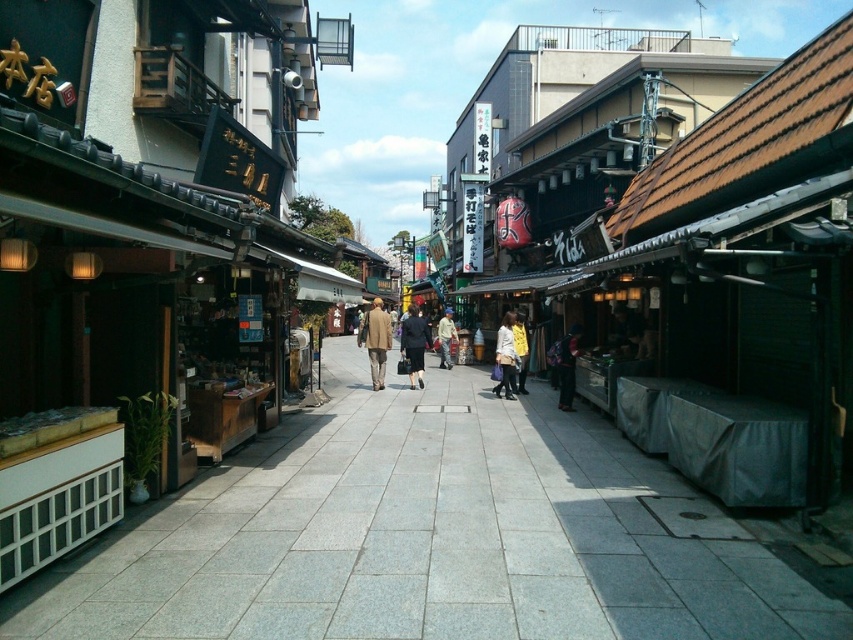
You are a street performer in the Japanese historic district. You have a matte black coat at center and a yellow fabric bag at center. Which one is more to the left?

The matte black coat at center is more to the left.

You are a delivery person carrying a package that requires a 30 feet clearance to maneuver safely. You see the gray stone pavement at center and the matte black coat at center in your path. Can you safely navigate through this section without hitting anything?

The distance between the gray stone pavement at center and the matte black coat at center is 27.06 feet, which is less than the required 30 feet clearance. Therefore, you cannot safely navigate through this section without the risk of hitting something.

Looking at this image, you are a photographer standing on the light gray tiles pavement in the traditional Japanese street scene. You want to take a photo of the light beige coat at center and the yellow matte jacket at center. Which one should you focus on first if you want to capture the taller object in the frame?

The yellow matte jacket at center is taller than the light beige coat at center, so you should focus on the yellow matte jacket at center first to capture the taller object in the frame.